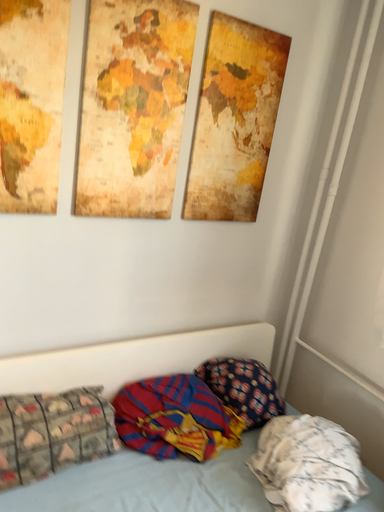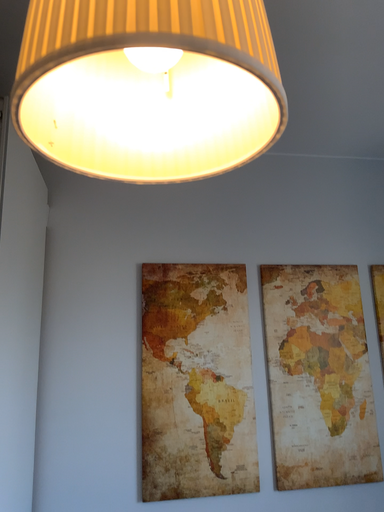
Question: Which way did the camera rotate in the video?

Choices:
 (A) rotated upward
 (B) rotated downward

Answer: (A)